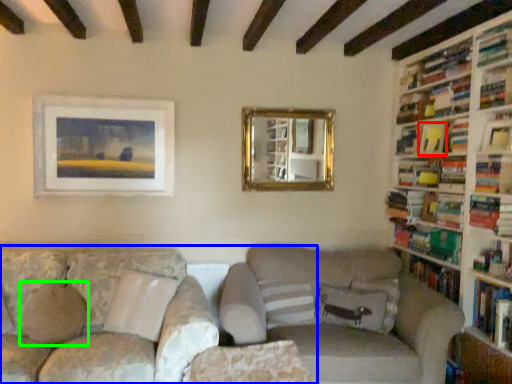
Question: Estimate the real-world distances between objects in this image. Which object is farther from book (highlighted by a red box), studio couch (highlighted by a blue box) or pillow (highlighted by a green box)?

Choices:
 (A) studio couch
 (B) pillow

Answer: (B)